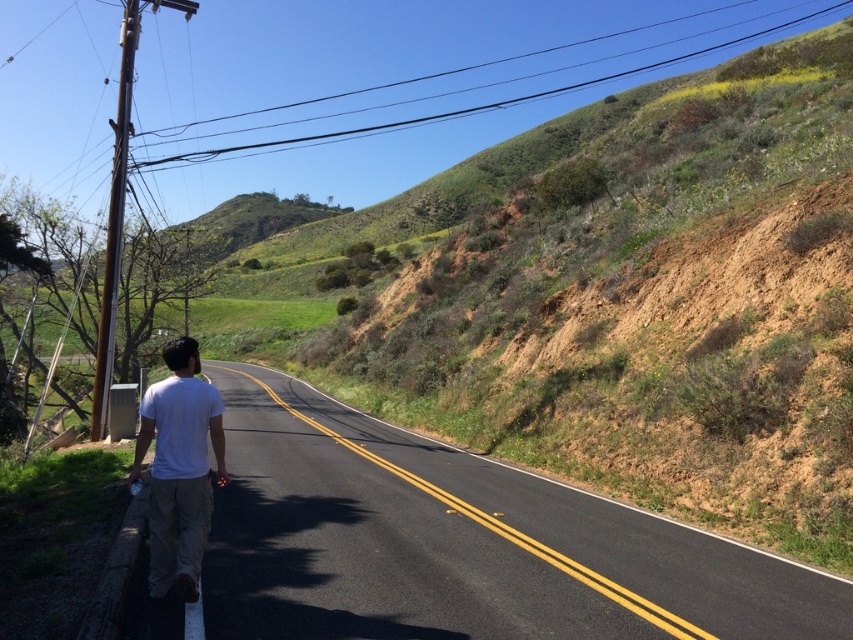
Is black asphalt highway at center wider than white cotton shirt at center?

Yes, black asphalt highway at center is wider than white cotton shirt at center.

Find the location of a particular element. black asphalt highway at center is located at coordinates (461, 545).

Which is behind, point (715, 600) or point (221, 467)?

The point (715, 600) is more distant.

You are a GUI agent. You are given a task and a screenshot of the screen. Output one action in this format:
    pyautogui.click(x=<x>, y=<y>)
    Task: Click on the black asphalt highway at center
    Image resolution: width=853 pixels, height=640 pixels.
    Given the screenshot: What is the action you would take?
    pyautogui.click(x=461, y=545)